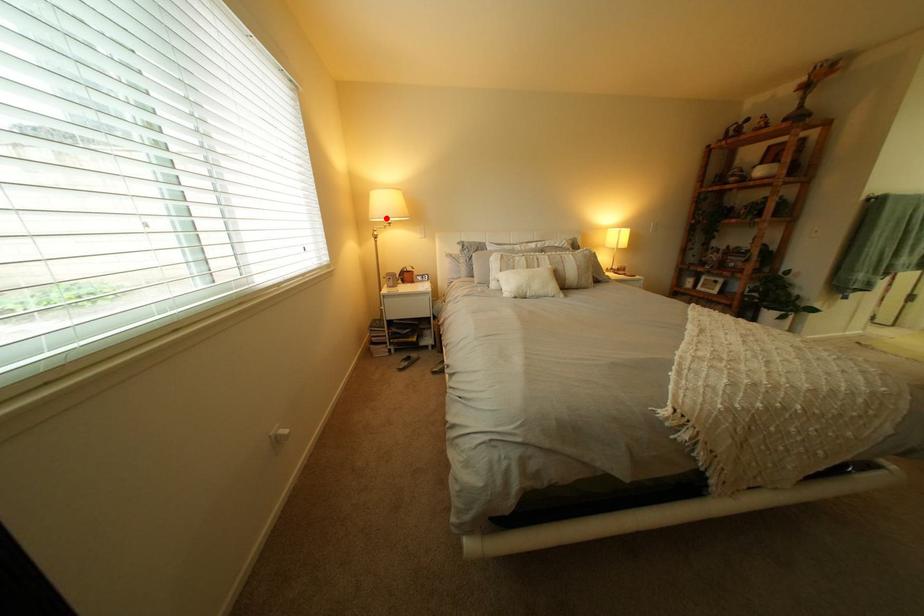
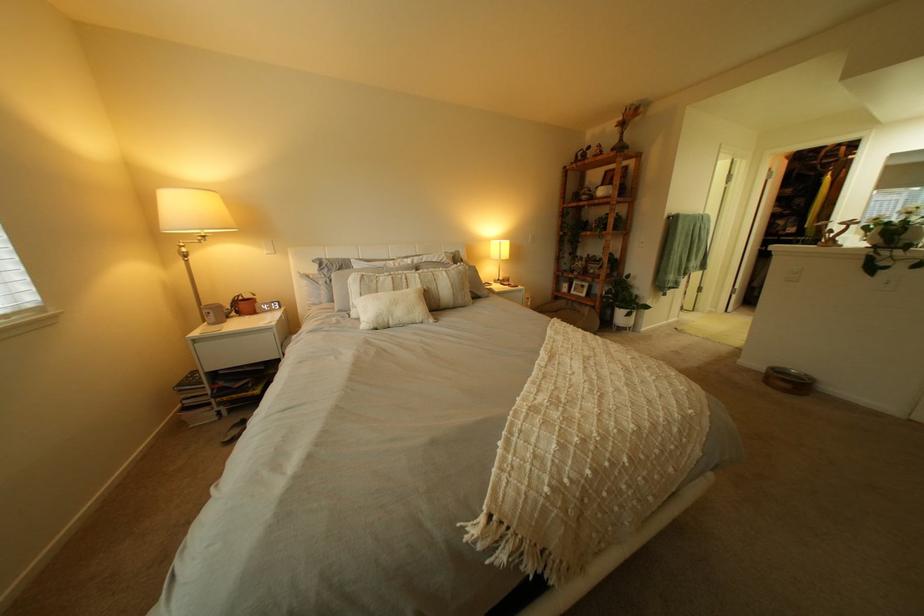
Find the pixel in the second image that matches the highlighted location in the first image.

(176, 229)